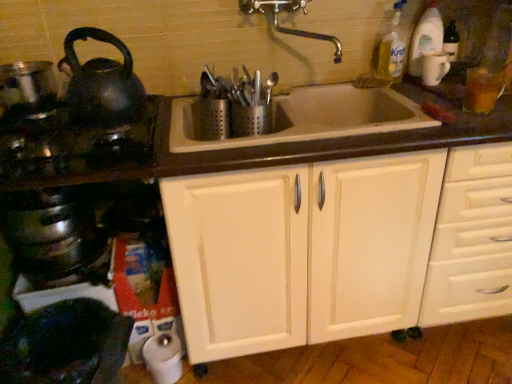
Question: Are shiny metallic crock pot at lower left and white wood cabinet at center far apart?

Choices:
 (A) yes
 (B) no

Answer: (B)

Question: Can you confirm if shiny metallic crock pot at lower left is shorter than white wood cabinet at center?

Choices:
 (A) no
 (B) yes

Answer: (B)

Question: Considering the relative sizes of shiny metallic crock pot at lower left and white wood cabinet at center in the image provided, is shiny metallic crock pot at lower left taller than white wood cabinet at center?

Choices:
 (A) no
 (B) yes

Answer: (A)

Question: Is shiny metallic crock pot at lower left at the left side of white wood cabinet at center?

Choices:
 (A) no
 (B) yes

Answer: (B)

Question: From the image's perspective, is shiny metallic crock pot at lower left located above white wood cabinet at center?

Choices:
 (A) no
 (B) yes

Answer: (A)

Question: From the image's perspective, is white wood cabinet at center above or below white glossy mug at upper right?

Choices:
 (A) above
 (B) below

Answer: (B)

Question: Which is correct: white wood cabinet at center is inside white glossy mug at upper right, or outside of it?

Choices:
 (A) outside
 (B) inside

Answer: (A)

Question: In terms of height, does white wood cabinet at center look taller or shorter compared to white glossy mug at upper right?

Choices:
 (A) short
 (B) tall

Answer: (B)

Question: In the image, is white wood cabinet at center positioned in front of or behind white glossy mug at upper right?

Choices:
 (A) behind
 (B) front

Answer: (B)

Question: Is point (90, 269) positioned closer to the camera than point (420, 69)?

Choices:
 (A) farther
 (B) closer

Answer: (B)

Question: Looking at their shapes, would you say shiny metallic crock pot at lower left is wider or thinner than white glossy mug at upper right?

Choices:
 (A) wide
 (B) thin

Answer: (A)

Question: Based on their sizes in the image, would you say shiny metallic crock pot at lower left is bigger or smaller than white glossy mug at upper right?

Choices:
 (A) big
 (B) small

Answer: (A)

Question: Considering the positions of shiny metallic crock pot at lower left and white glossy mug at upper right in the image, is shiny metallic crock pot at lower left taller or shorter than white glossy mug at upper right?

Choices:
 (A) short
 (B) tall

Answer: (A)

Question: From a real-world perspective, is white ceramic sink at center positioned above or below shiny metallic pot at left?

Choices:
 (A) below
 (B) above

Answer: (A)

Question: Is point (378, 129) positioned closer to the camera than point (44, 64)?

Choices:
 (A) farther
 (B) closer

Answer: (B)